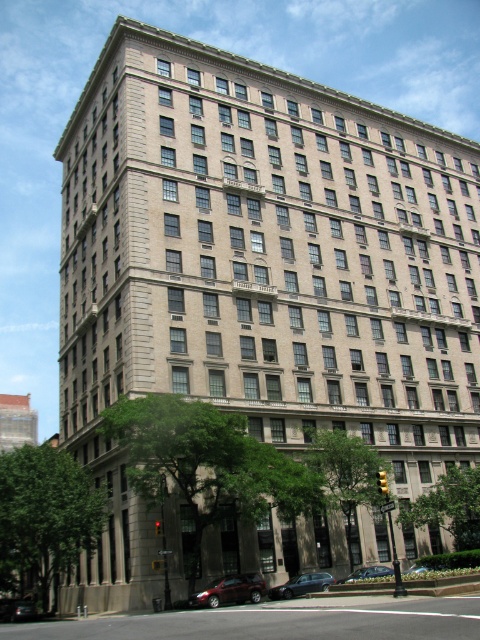
You are a pedestrian standing on the sidewalk in front of the building and want to cross the street to reach the trees. You see the metallic red car at lower left and the metallic silver sedan at center. Which car is closer to the sidewalk?

The metallic red car at lower left is closer to the sidewalk because it is positioned on the left side of the metallic silver sedan at center, which is further away from the sidewalk.

You are standing at the entrance of the building and want to park your metallic silver sedan at lower center. The parking spot is located at coordinates point (367, 573). Can you safely navigate your vehicle to the parking spot without hitting any obstacles?

The metallic silver sedan at lower center is already at point (367, 573), so you are already at the parking spot.